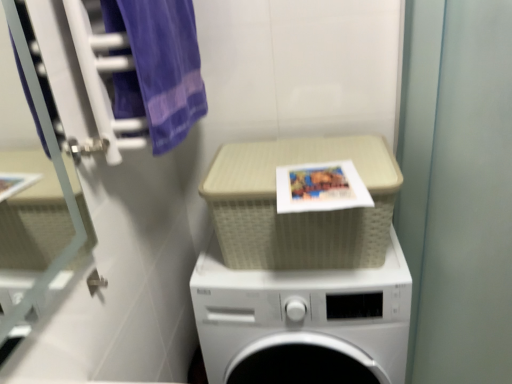
Question: From the image's perspective, is purple cotton towel at upper left above green matte screen door at right?

Choices:
 (A) yes
 (B) no

Answer: (A)

Question: Is purple cotton towel at upper left facing towards green matte screen door at right?

Choices:
 (A) no
 (B) yes

Answer: (B)

Question: Can you confirm if purple cotton towel at upper left is smaller than green matte screen door at right?

Choices:
 (A) yes
 (B) no

Answer: (A)

Question: Can you confirm if purple cotton towel at upper left is shorter than green matte screen door at right?

Choices:
 (A) yes
 (B) no

Answer: (A)

Question: Is purple cotton towel at upper left directly adjacent to green matte screen door at right?

Choices:
 (A) yes
 (B) no

Answer: (B)

Question: Is purple cotton towel at upper left positioned with its back to green matte screen door at right?

Choices:
 (A) no
 (B) yes

Answer: (A)

Question: Is there a large distance between purple cotton towel at upper left and matte paper book cover at center?

Choices:
 (A) no
 (B) yes

Answer: (A)

Question: Is purple cotton towel at upper left taller than matte paper book cover at center?

Choices:
 (A) no
 (B) yes

Answer: (B)

Question: Does purple cotton towel at upper left have a larger size compared to matte paper book cover at center?

Choices:
 (A) yes
 (B) no

Answer: (A)

Question: Is purple cotton towel at upper left to the left of matte paper book cover at center from the viewer's perspective?

Choices:
 (A) yes
 (B) no

Answer: (A)

Question: From a real-world perspective, is purple cotton towel at upper left under matte paper book cover at center?

Choices:
 (A) yes
 (B) no

Answer: (B)

Question: Would you say purple cotton towel at upper left is outside matte paper book cover at center?

Choices:
 (A) no
 (B) yes

Answer: (B)

Question: Is green matte screen door at right behind white plastic washing machine at center?

Choices:
 (A) yes
 (B) no

Answer: (B)